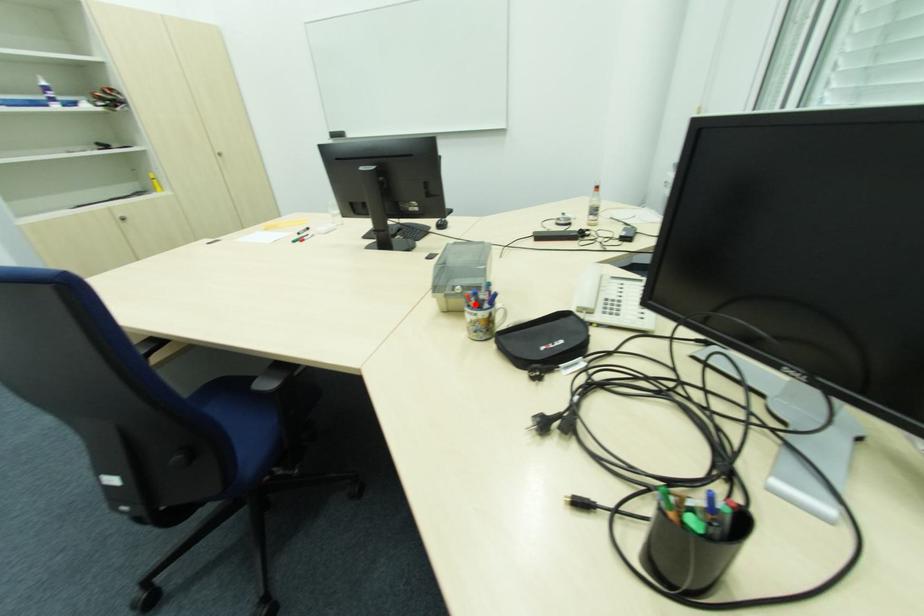
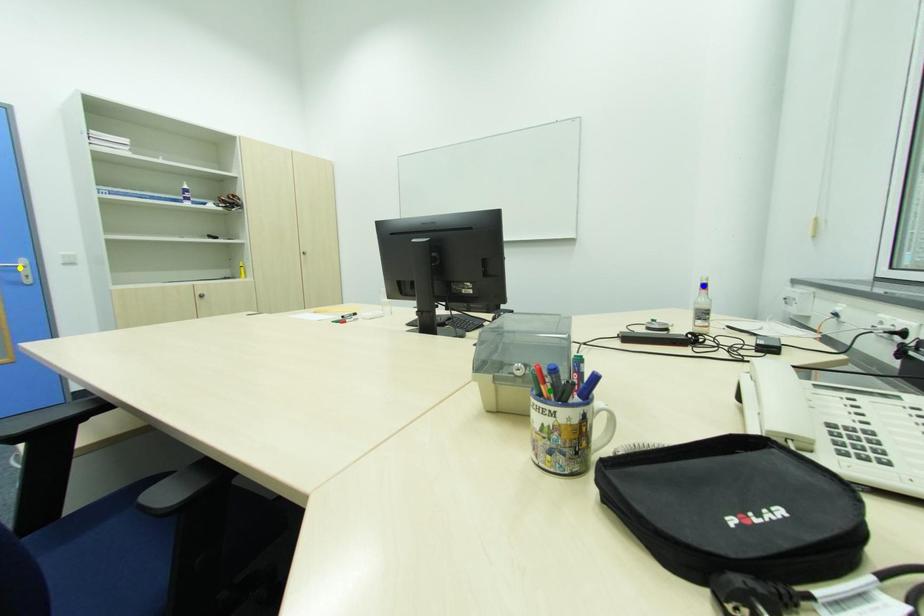
Question: I am providing you with two images of the same scene from different viewpoints. A red point is marked on the first image. You are given multiple points on the second image. In image 2, which mark is for the same physical point as the one in image 1?

Choices:
 (A) blue point
 (B) yellow point
 (C) green point

Answer: (C)